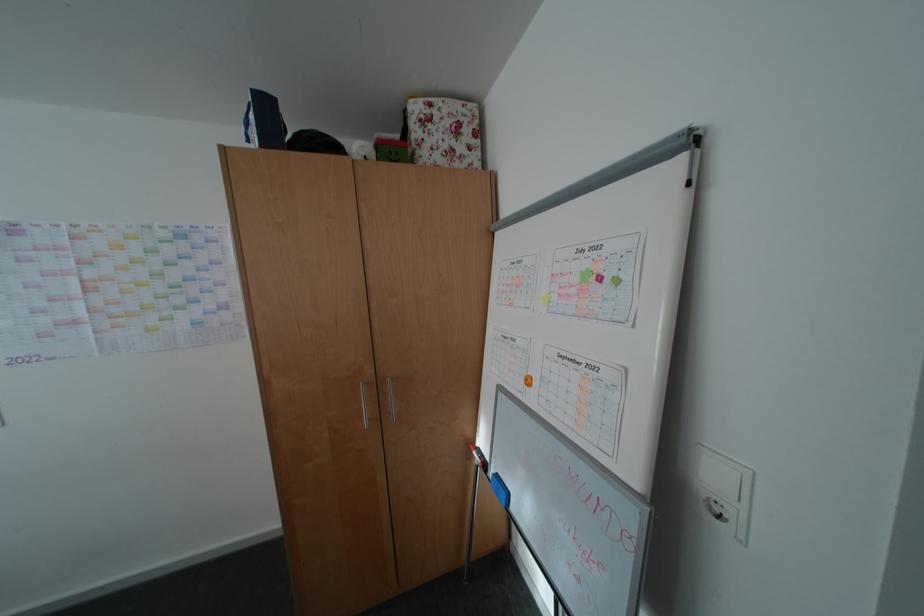
The location [553,302] corresponds to which object?

It corresponds to the green sticky note in the image.